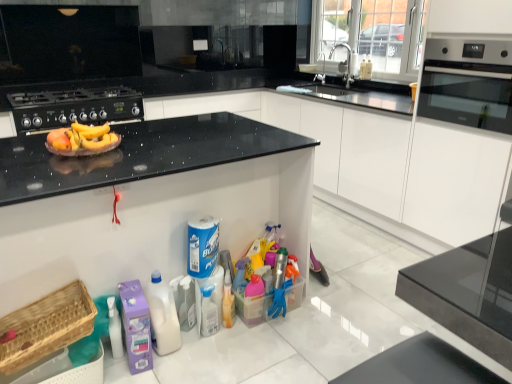
Question: In which direction should I rotate to look at silver metallic faucet at upper center, acting as the 2th faucet starting from the front?

Choices:
 (A) right
 (B) left

Answer: (A)

Question: Are black glass oven at right and white plastic bottle at lower center, positioned as the second cleaning product in right-to-left order, located far from each other?

Choices:
 (A) no
 (B) yes

Answer: (B)

Question: Are black glass oven at right and white plastic bottle at lower center, positioned as the second cleaning product in right-to-left order, beside each other?

Choices:
 (A) no
 (B) yes

Answer: (A)

Question: Is black glass oven at right wider than white plastic bottle at lower center, the second cleaning product viewed from the left?

Choices:
 (A) no
 (B) yes

Answer: (B)

Question: Considering the relative sizes of black glass oven at right and white plastic bottle at lower center, the second cleaning product viewed from the left, in the image provided, is black glass oven at right thinner than white plastic bottle at lower center, the second cleaning product viewed from the left,?

Choices:
 (A) no
 (B) yes

Answer: (A)

Question: Would you say white plastic bottle at lower center, positioned as the second cleaning product in right-to-left order, is part of black glass oven at right's contents?

Choices:
 (A) no
 (B) yes

Answer: (A)

Question: Considering the relative positions of black glass oven at right and white plastic bottle at lower center, positioned as the second cleaning product in right-to-left order, in the image provided, is black glass oven at right to the left of white plastic bottle at lower center, positioned as the second cleaning product in right-to-left order, from the viewer's perspective?

Choices:
 (A) yes
 (B) no

Answer: (B)

Question: Considering the relative positions of silver metallic faucet at upper center, acting as the 2th faucet starting from the front, and purple plastic laundry detergent at lower left, which is the 3th cleaning product in right-to-left order, in the image provided, is silver metallic faucet at upper center, acting as the 2th faucet starting from the front, to the right of purple plastic laundry detergent at lower left, which is the 3th cleaning product in right-to-left order, from the viewer's perspective?

Choices:
 (A) yes
 (B) no

Answer: (A)

Question: From a real-world perspective, does silver metallic faucet at upper center, marked as the first faucet in a back-to-front arrangement, stand above purple plastic laundry detergent at lower left, the first cleaning product when ordered from left to right?

Choices:
 (A) yes
 (B) no

Answer: (A)

Question: Is silver metallic faucet at upper center, acting as the 2th faucet starting from the front, to the left of purple plastic laundry detergent at lower left, which is the 3th cleaning product in right-to-left order, from the viewer's perspective?

Choices:
 (A) no
 (B) yes

Answer: (A)

Question: Is silver metallic faucet at upper center, marked as the first faucet in a back-to-front arrangement, surrounding purple plastic laundry detergent at lower left, the first cleaning product when ordered from left to right?

Choices:
 (A) no
 (B) yes

Answer: (A)

Question: Is silver metallic faucet at upper center, acting as the 2th faucet starting from the front, far away from purple plastic laundry detergent at lower left, which is the 3th cleaning product in right-to-left order?

Choices:
 (A) yes
 (B) no

Answer: (A)

Question: Is silver metallic faucet at upper center, acting as the 2th faucet starting from the front, oriented towards purple plastic laundry detergent at lower left, the first cleaning product when ordered from left to right?

Choices:
 (A) no
 (B) yes

Answer: (A)

Question: From the image's perspective, is purple plastic laundry detergent at lower left, which is the 3th cleaning product in right-to-left order, above translucent plastic spray bottle at center?

Choices:
 (A) no
 (B) yes

Answer: (A)